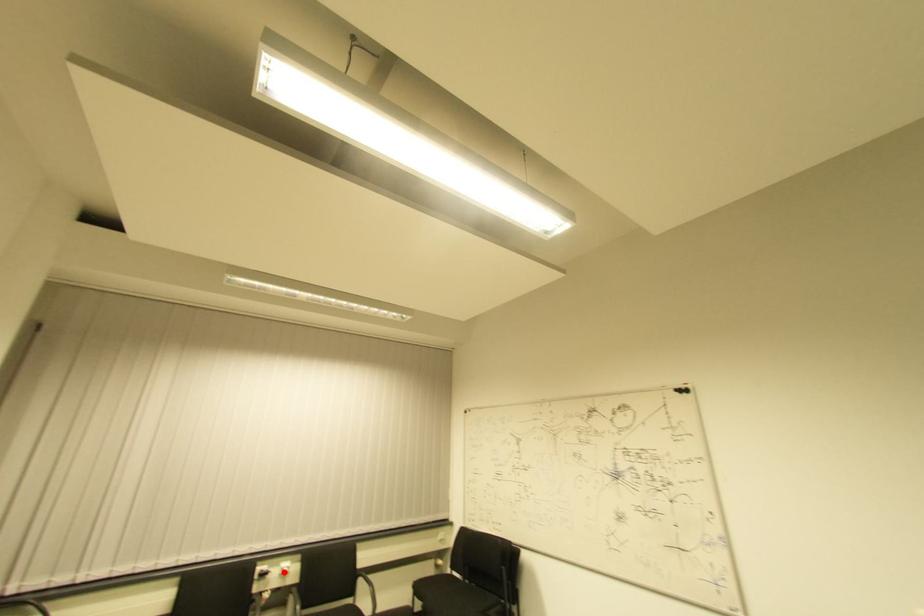
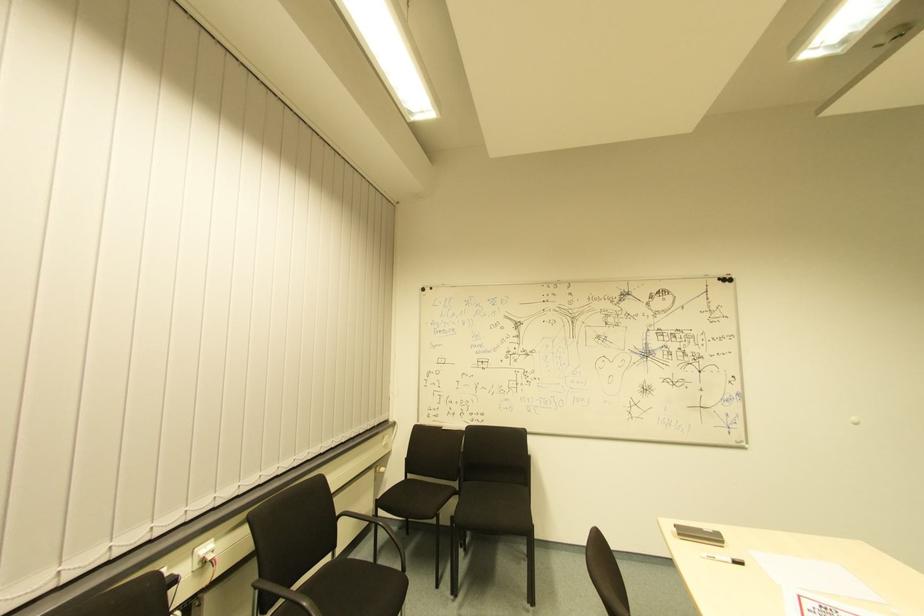
Find the pixel in the second image that matches the highlighted location in the first image.

(208, 561)